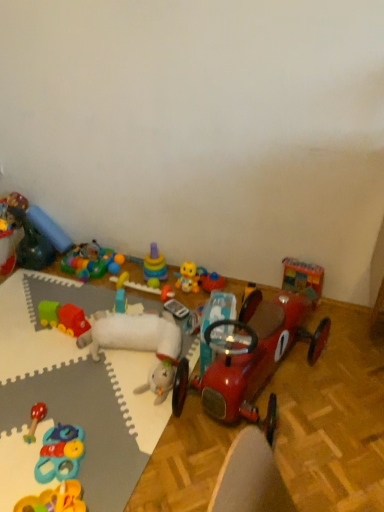
Locate an element on the screen. Image resolution: width=384 pixels, height=512 pixels. free space in front of wooden toy car at upper right, the twelfth toy when ordered from left to right is located at coordinates (327, 330).